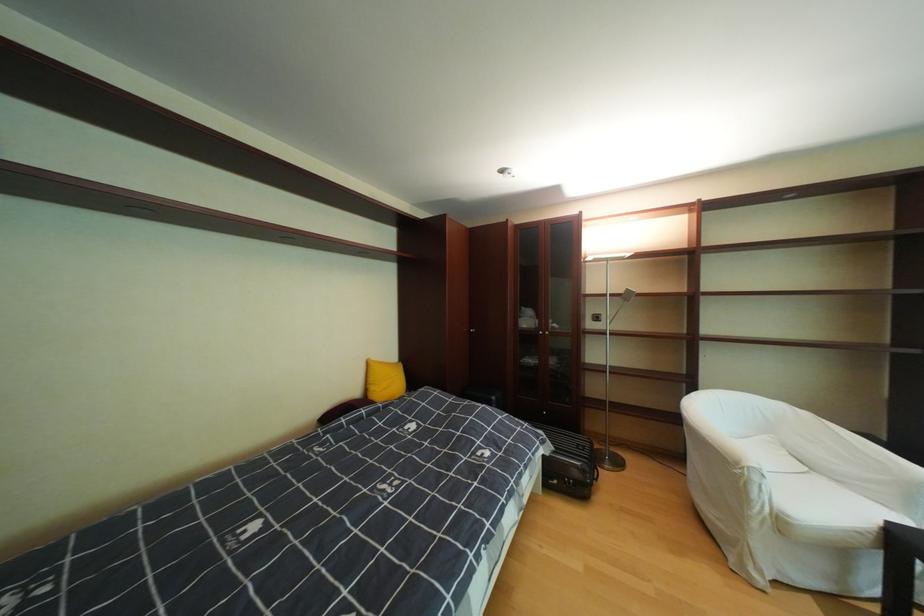
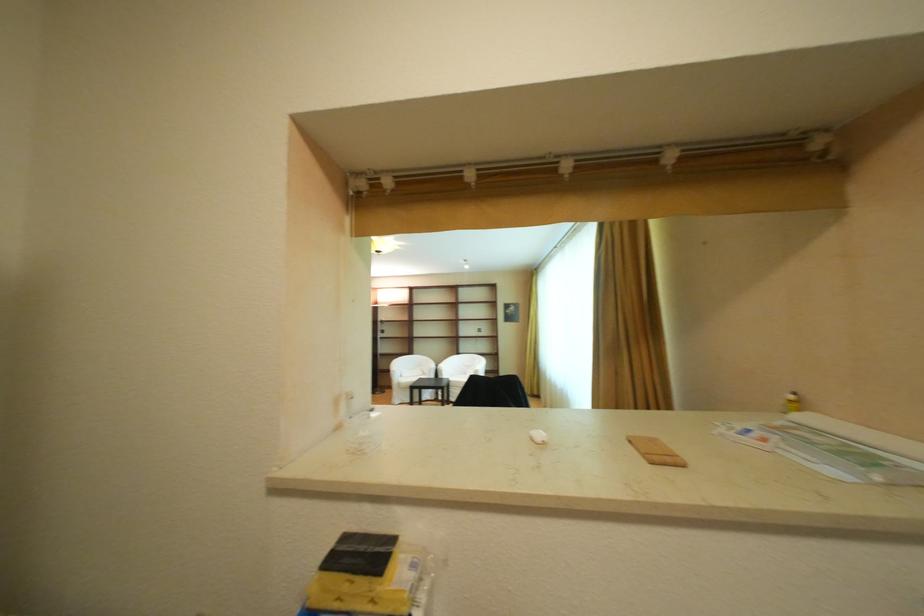
In the second image, find the point that corresponds to (x=793, y=407) in the first image.

(436, 359)